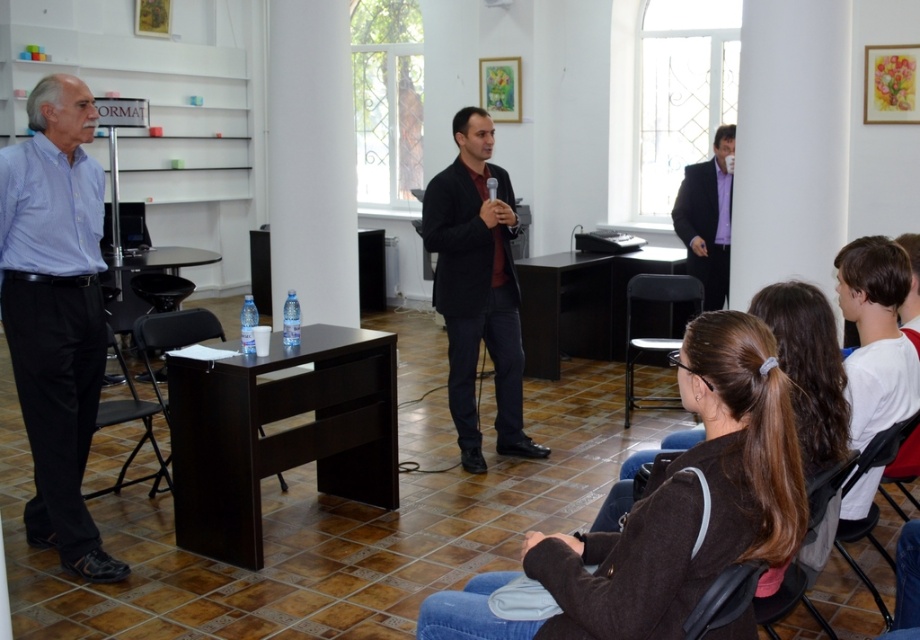
You are organizing a small workshop and need to seat two participants. You have a black plastic chair at lower center and a black leather chair at lower right. Which chair should you choose if you want a wider seat for comfort?

Result: The black plastic chair at lower center might be wider than the black leather chair at lower right, so it would be the better choice for a wider seat.

You are sitting in the black plastic chair at left and want to move to the black leather chair at lower right. Which direction should you move to reach it?

The black leather chair at lower right is positioned on the right side of the black plastic chair at left, so you should move to your right to reach it.

You are standing at the point labeled as point (798, 584) in the room. If you want to take a photo of the entire room, which direction should you move to be 10 feet away from the camera position?

You need to move away from the camera position by 2.35 feet because the current distance between point (798, 584) and the camera is 7.65 feet. Adding that to 2.35 feet will make the total distance 10 feet.